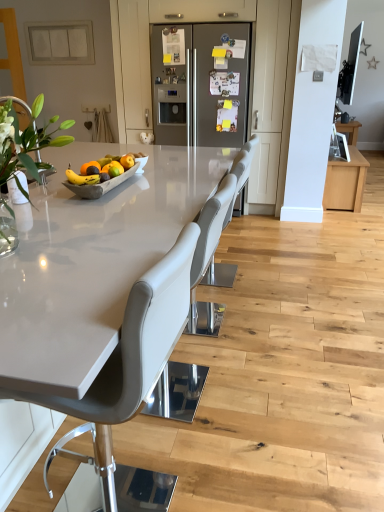
You are a GUI agent. You are given a task and a screenshot of the screen. Output one action in this format:
    pyautogui.click(x=<x>, y=<y>)
    Task: Click on the vacant space in between gray leather chair at center, the 2th chair in the front-to-back sequence, and matte gray chair at center, which is the third chair in back-to-front order
    This screenshot has width=384, height=512.
    Given the screenshot: What is the action you would take?
    pyautogui.click(x=161, y=445)